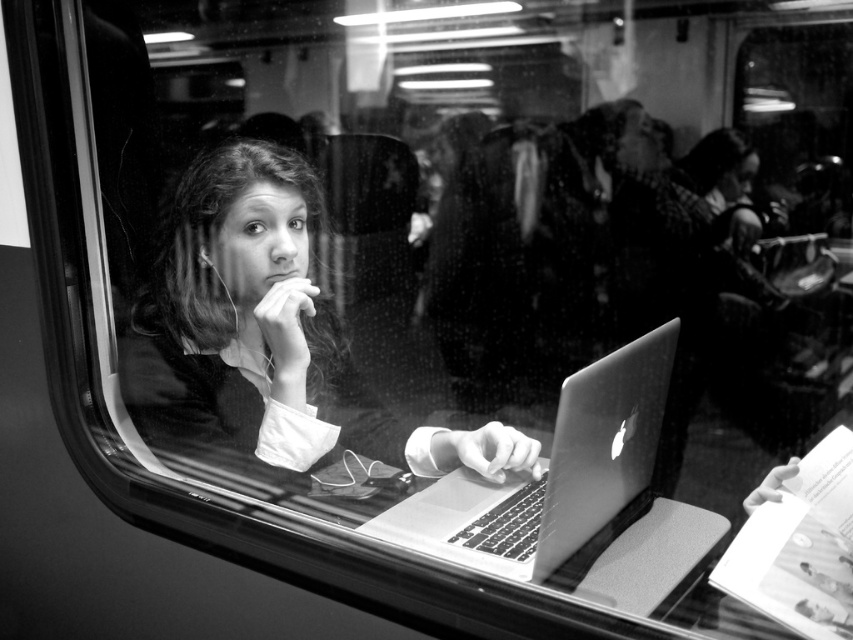
Question: Can you confirm if smooth skin girl at center is positioned above metallic silver laptop at center?

Choices:
 (A) no
 (B) yes

Answer: (B)

Question: Which object appears closest to the camera in this image?

Choices:
 (A) metallic silver laptop at center
 (B) smooth skin girl at center

Answer: (A)

Question: Is smooth skin girl at center below metallic silver laptop at center?

Choices:
 (A) yes
 (B) no

Answer: (B)

Question: Is smooth skin girl at center thinner than metallic silver laptop at center?

Choices:
 (A) no
 (B) yes

Answer: (A)